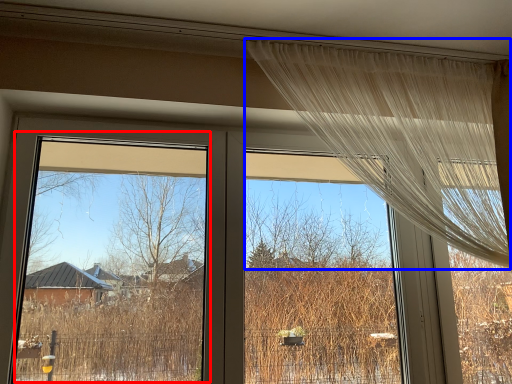
Question: Which point is further to the camera, window screen (highlighted by a red box) or curtain (highlighted by a blue box)?

Choices:
 (A) window screen
 (B) curtain

Answer: (B)